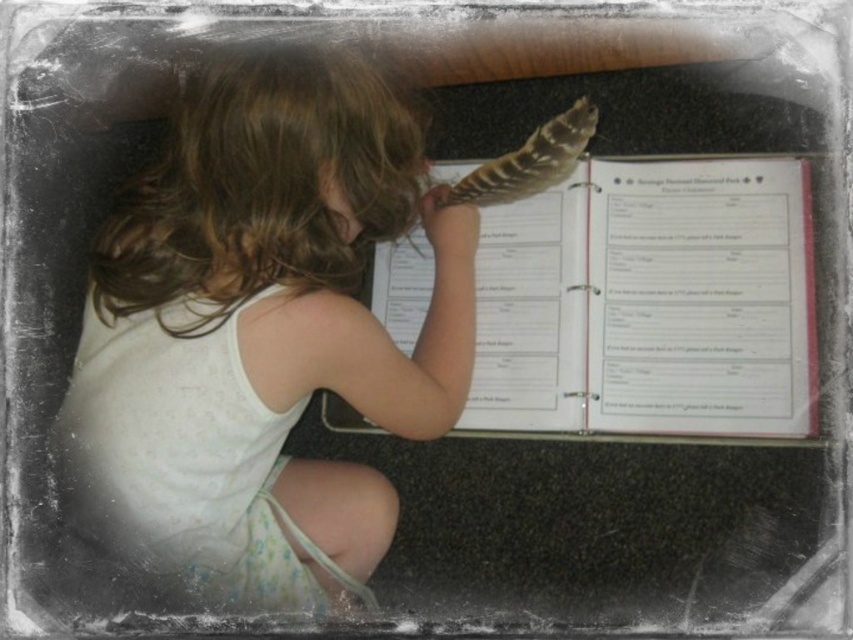
You are a teacher observing a child in a classroom. You notice the white cotton shirt at center and the brown feather at upper center. Which object is taller?

The white cotton shirt at center is taller than the brown feather at upper center.

The child in the scene is wearing a white cotton shirt at center and holding a brown feather at upper center. Which object is closer to the viewer?

The brown feather at upper center is closer to the viewer because it is positioned above the white cotton shirt at center.